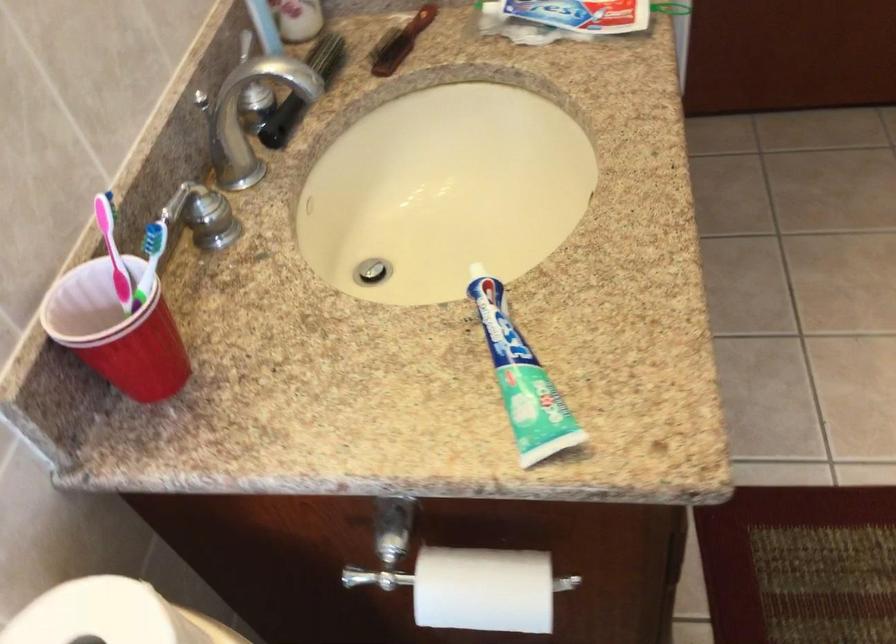
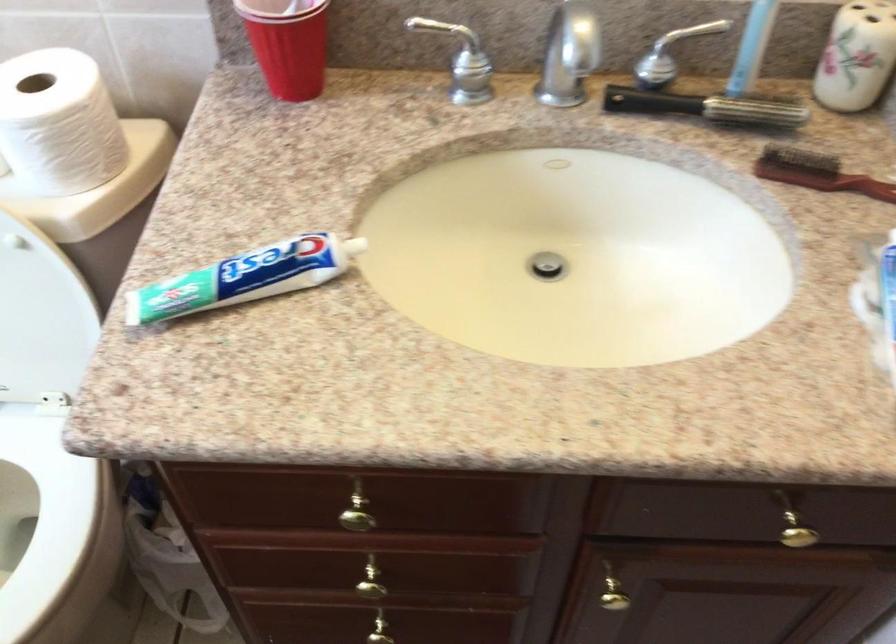
Where in the second image is the point corresponding to point (156, 323) from the first image?

(288, 44)